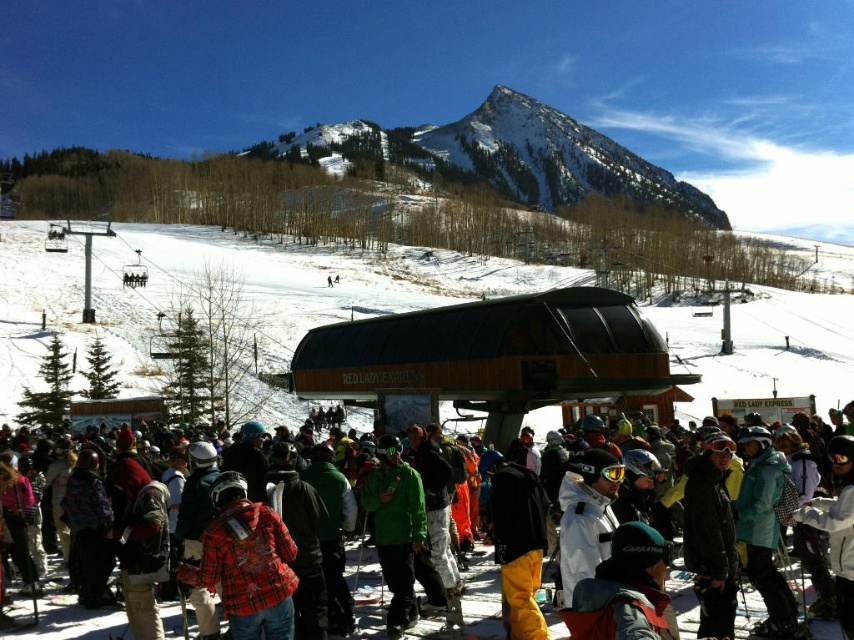
Does plaid fabric jacket at center appear on the left side of green matte jacket at center?

Yes, plaid fabric jacket at center is to the left of green matte jacket at center.

Is plaid fabric jacket at center bigger than green matte jacket at center?

Actually, plaid fabric jacket at center might be smaller than green matte jacket at center.

Is point (244, 595) behind point (419, 499)?

No, it is not.

Locate an element on the screen. This screenshot has width=854, height=640. plaid fabric jacket at center is located at coordinates (246, 563).

Between snowy granite mountain at upper center and plaid fabric jacket at center, which one is positioned lower?

Positioned lower is plaid fabric jacket at center.

From the picture: Does snowy granite mountain at upper center have a greater width compared to plaid fabric jacket at center?

Yes.

Who is more distant from viewer, (x=527, y=154) or (x=266, y=538)?

Point (x=527, y=154)

Identify the location of snowy granite mountain at upper center. This screenshot has height=640, width=854. (507, 157).

What do you see at coordinates (224, 275) in the screenshot? The width and height of the screenshot is (854, 640). I see `white powdery snow at center` at bounding box center [224, 275].

Who is more forward, (10,333) or (247,529)?

Point (247,529) is more forward.

The image size is (854, 640). Identify the location of white powdery snow at center. (224, 275).